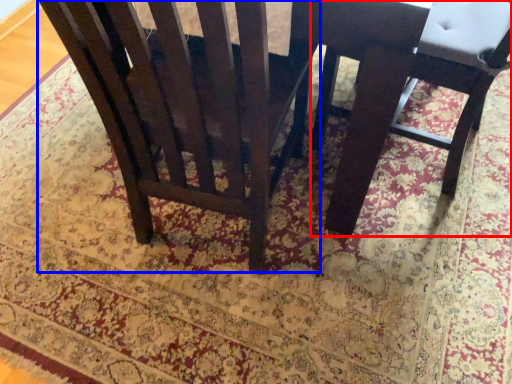
Question: Which object appears farthest to the camera in this image, chair (highlighted by a red box) or chair (highlighted by a blue box)?

Choices:
 (A) chair
 (B) chair

Answer: (A)